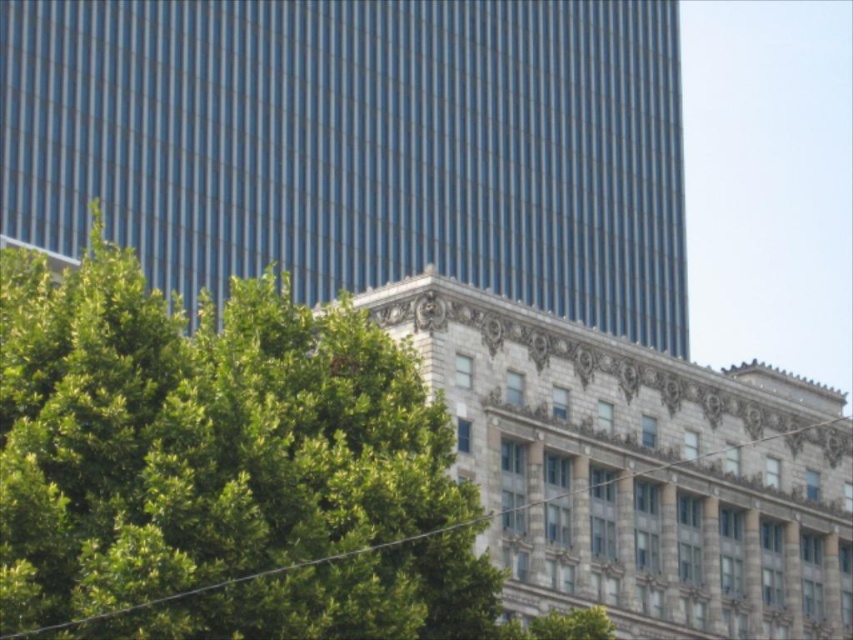
Is glassy blue skyscraper at upper left shorter than green leafy tree at lower left?

No, glassy blue skyscraper at upper left is not shorter than green leafy tree at lower left.

Which is in front, point (154, 90) or point (474, 636)?

Point (474, 636)

This screenshot has height=640, width=853. I want to click on glassy blue skyscraper at upper left, so click(x=358, y=145).